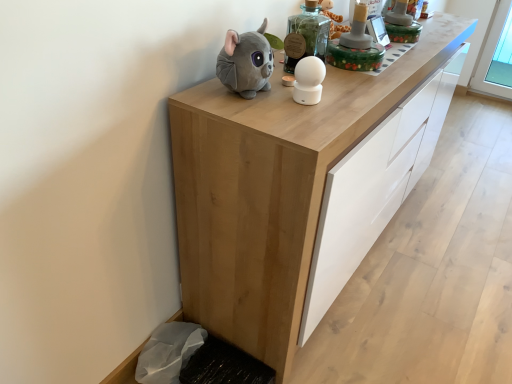
What do you see at coordinates (265, 195) in the screenshot?
I see `natural wood cabinet at center` at bounding box center [265, 195].

In order to face natural wood cabinet at center, should I rotate leftwards or rightwards?

You should look right and rotate roughly 12.514 degrees.

The image size is (512, 384). What do you see at coordinates (308, 80) in the screenshot? I see `white matte ball at center, which is counted as the 1th toy, starting from the right` at bounding box center [308, 80].

Locate an element on the screen. The width and height of the screenshot is (512, 384). soft gray plush toy at upper center, marked as the second toy in a right-to-left arrangement is located at coordinates (246, 62).

Locate an element on the screen. This screenshot has width=512, height=384. natural wood cabinet at center is located at coordinates (265, 195).

How far apart are white matte ball at center, which is the 2th toy in left-to-right order, and natural wood cabinet at center?

white matte ball at center, which is the 2th toy in left-to-right order, is 16.38 inches away from natural wood cabinet at center.

Are white matte ball at center, which is counted as the 1th toy, starting from the right, and natural wood cabinet at center located far from each other?

white matte ball at center, which is counted as the 1th toy, starting from the right, is near natural wood cabinet at center, not far away.

From the image's perspective, is white matte ball at center, which is the 2th toy in left-to-right order, below natural wood cabinet at center?

Incorrect, from the image's perspective, white matte ball at center, which is the 2th toy in left-to-right order, is higher than natural wood cabinet at center.

Considering the relative sizes of white matte ball at center, which is the 2th toy in left-to-right order, and natural wood cabinet at center in the image provided, is white matte ball at center, which is the 2th toy in left-to-right order, taller than natural wood cabinet at center?

In fact, white matte ball at center, which is the 2th toy in left-to-right order, may be shorter than natural wood cabinet at center.

At what (x,y) coordinates should I click in order to perform the action: click on toy above the white matte ball at center, which is the 2th toy in left-to-right order (from a real-world perspective). Please return your answer as a coordinate pair (x, y). The height and width of the screenshot is (384, 512). Looking at the image, I should click on (246, 62).

Is white matte ball at center, which is the 2th toy in left-to-right order, bigger or smaller than soft gray plush toy at upper center, the 1th toy positioned from the left?

In the image, white matte ball at center, which is the 2th toy in left-to-right order, appears to be smaller than soft gray plush toy at upper center, the 1th toy positioned from the left.

Is white matte ball at center, which is the 2th toy in left-to-right order, not close to soft gray plush toy at upper center, the 1th toy positioned from the left?

No, white matte ball at center, which is the 2th toy in left-to-right order, is not far from soft gray plush toy at upper center, the 1th toy positioned from the left.

Is white matte ball at center, which is the 2th toy in left-to-right order, to the left of soft gray plush toy at upper center, marked as the second toy in a right-to-left arrangement, from the viewer's perspective?

No, white matte ball at center, which is the 2th toy in left-to-right order, is not to the left of soft gray plush toy at upper center, marked as the second toy in a right-to-left arrangement.

Considering the relative positions of natural wood cabinet at center and white matte ball at center, which is counted as the 1th toy, starting from the right, in the image provided, is natural wood cabinet at center to the right of white matte ball at center, which is counted as the 1th toy, starting from the right, from the viewer's perspective?

Indeed, natural wood cabinet at center is positioned on the right side of white matte ball at center, which is counted as the 1th toy, starting from the right.

Locate an element on the screen. The image size is (512, 384). cabinetry in front of the white matte ball at center, which is the 2th toy in left-to-right order is located at coordinates (265, 195).

From the image's perspective, who appears lower, natural wood cabinet at center or white matte ball at center, which is counted as the 1th toy, starting from the right?

natural wood cabinet at center is shown below in the image.

Is natural wood cabinet at center positioned before white matte ball at center, which is counted as the 1th toy, starting from the right?

Yes, it is in front of white matte ball at center, which is counted as the 1th toy, starting from the right.

Between point (258, 78) and point (404, 74), which one is positioned behind?

The point (404, 74) is more distant.

Is the position of soft gray plush toy at upper center, the 1th toy positioned from the left, more distant than that of natural wood cabinet at center?

Yes, soft gray plush toy at upper center, the 1th toy positioned from the left, is further from the viewer.

Is soft gray plush toy at upper center, the 1th toy positioned from the left, wider or thinner than natural wood cabinet at center?

soft gray plush toy at upper center, the 1th toy positioned from the left, is thinner than natural wood cabinet at center.

How distant is soft gray plush toy at upper center, the 1th toy positioned from the left, from natural wood cabinet at center?

They are 14.67 inches apart.

Who is taller, natural wood cabinet at center or soft gray plush toy at upper center, the 1th toy positioned from the left?

natural wood cabinet at center is taller.

From a real-world perspective, which object stands above the other?

soft gray plush toy at upper center, the 1th toy positioned from the left, is physically above.

Identify the location of cabinetry in front of the soft gray plush toy at upper center, the 1th toy positioned from the left. This screenshot has height=384, width=512. (265, 195).

From the picture: Which is further, [277,109] or [219,78]?

Point [219,78]

From the image's perspective, is soft gray plush toy at upper center, marked as the second toy in a right-to-left arrangement, below white matte ball at center, which is counted as the 1th toy, starting from the right?

Incorrect, from the image's perspective, soft gray plush toy at upper center, marked as the second toy in a right-to-left arrangement, is higher than white matte ball at center, which is counted as the 1th toy, starting from the right.

Is soft gray plush toy at upper center, marked as the second toy in a right-to-left arrangement, situated inside white matte ball at center, which is the 2th toy in left-to-right order, or outside?

The correct answer is: outside.

How many degrees apart are the facing directions of soft gray plush toy at upper center, marked as the second toy in a right-to-left arrangement, and white matte ball at center, which is the 2th toy in left-to-right order?

There is a 1.34-degree angle between the facing directions of soft gray plush toy at upper center, marked as the second toy in a right-to-left arrangement, and white matte ball at center, which is the 2th toy in left-to-right order.

Image resolution: width=512 pixels, height=384 pixels. Identify the location of cabinetry lying on the right of white matte ball at center, which is the 2th toy in left-to-right order. (265, 195).

I want to click on toy above the white matte ball at center, which is counted as the 1th toy, starting from the right (from a real-world perspective), so click(246, 62).

Looking at the image, which one is located further to white matte ball at center, which is the 2th toy in left-to-right order, natural wood cabinet at center or soft gray plush toy at upper center, the 1th toy positioned from the left?

Based on the image, natural wood cabinet at center appears to be further to white matte ball at center, which is the 2th toy in left-to-right order.

Estimate the real-world distances between objects in this image. Which object is further from white matte ball at center, which is counted as the 1th toy, starting from the right, soft gray plush toy at upper center, marked as the second toy in a right-to-left arrangement, or natural wood cabinet at center?

natural wood cabinet at center lies further to white matte ball at center, which is counted as the 1th toy, starting from the right, than the other object.

Considering their positions, is white matte ball at center, which is the 2th toy in left-to-right order, positioned further to soft gray plush toy at upper center, marked as the second toy in a right-to-left arrangement, than natural wood cabinet at center?

Among the two, natural wood cabinet at center is located further to soft gray plush toy at upper center, marked as the second toy in a right-to-left arrangement.

Which object lies further to the anchor point natural wood cabinet at center, soft gray plush toy at upper center, the 1th toy positioned from the left, or white matte ball at center, which is counted as the 1th toy, starting from the right?

white matte ball at center, which is counted as the 1th toy, starting from the right, is positioned further to the anchor natural wood cabinet at center.

Considering their positions, is natural wood cabinet at center positioned closer to soft gray plush toy at upper center, marked as the second toy in a right-to-left arrangement, than white matte ball at center, which is counted as the 1th toy, starting from the right?

white matte ball at center, which is counted as the 1th toy, starting from the right.

When comparing their distances from natural wood cabinet at center, does white matte ball at center, which is the 2th toy in left-to-right order, or soft gray plush toy at upper center, marked as the second toy in a right-to-left arrangement, seem closer?

Based on the image, soft gray plush toy at upper center, marked as the second toy in a right-to-left arrangement, appears to be nearer to natural wood cabinet at center.

Identify the location of toy located between soft gray plush toy at upper center, marked as the second toy in a right-to-left arrangement, and natural wood cabinet at center in the left-right direction. (308, 80).